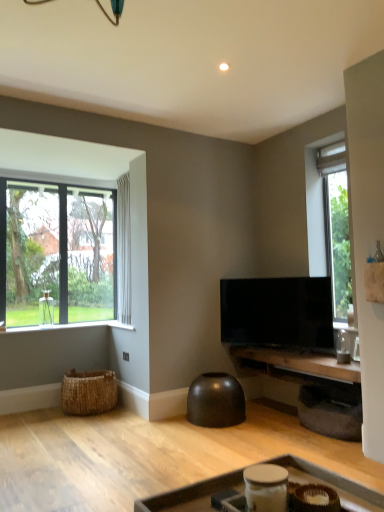
Locate an element on the screen. The image size is (384, 512). wooden table at center, the 1th table positioned from the back is located at coordinates (293, 365).

Locate an element on the screen. The width and height of the screenshot is (384, 512). wooden tray at lower center, which is the 2th table in back-to-front order is located at coordinates (191, 495).

Identify the location of clear glass window at left. (59, 253).

Measure the distance between clear glass window at left and camera.

clear glass window at left and camera are 14.50 feet apart from each other.

The height and width of the screenshot is (512, 384). What are the coordinates of `woven brown basket at lower left` in the screenshot? It's located at (88, 392).

Describe the element at coordinates (88, 392) in the screenshot. I see `woven brown basket at lower left` at that location.

The image size is (384, 512). Describe the element at coordinates (73, 326) in the screenshot. I see `white wood window sill at lower left` at that location.

Image resolution: width=384 pixels, height=512 pixels. In order to click on flat screen tv at center in this screenshot , I will do `click(277, 312)`.

Is the surface of clear glass window at left in direct contact with white wood window sill at lower left?

No, clear glass window at left is not with white wood window sill at lower left.

Is clear glass window at left oriented towards white wood window sill at lower left?

Yes, clear glass window at left is facing white wood window sill at lower left.

How many degrees apart are the facing directions of clear glass window at left and white wood window sill at lower left?

The angular difference between clear glass window at left and white wood window sill at lower left is 0.196 degrees.

Is white wood window sill at lower left surrounded by clear glass window at left?

No, white wood window sill at lower left is not surrounded by clear glass window at left.

Who is more distant, white sheer curtain at left or flat screen tv at center?

white sheer curtain at left is more distant.

Between white sheer curtain at left and flat screen tv at center, which one has smaller size?

Smaller between the two is flat screen tv at center.

Is white sheer curtain at left not near flat screen tv at center?

That's right, there is a large distance between white sheer curtain at left and flat screen tv at center.

The height and width of the screenshot is (512, 384). What are the coordinates of `curtain above the flat screen tv at center (from the image's perspective)` in the screenshot? It's located at (123, 250).

Locate an element on the screen. table that appears on the right of wooden tray at lower center, marked as the 1th table in a front-to-back arrangement is located at coordinates (293, 365).

From a real-world perspective, which object stands above the other?

In real-world perspective, wooden table at center, the 1th table positioned from the back, is above.

Who is more distant, wooden table at center, the 1th table positioned from the back, or wooden tray at lower center, which is the 2th table in back-to-front order?

wooden table at center, the 1th table positioned from the back.

Based on their sizes in the image, would you say wooden table at center, which is the 2th table from front to back, is bigger or smaller than wooden tray at lower center, which is the 2th table in back-to-front order?

In the image, wooden table at center, which is the 2th table from front to back, appears to be smaller than wooden tray at lower center, which is the 2th table in back-to-front order.

Locate an element on the screen. curtain above the wooden table at center, the 1th table positioned from the back (from the image's perspective) is located at coordinates (123, 250).

Would you say white sheer curtain at left is outside wooden table at center, the 1th table positioned from the back?

white sheer curtain at left lies outside wooden table at center, the 1th table positioned from the back,'s area.

How many degrees apart are the facing directions of white sheer curtain at left and wooden table at center, the 1th table positioned from the back?

The angular difference between white sheer curtain at left and wooden table at center, the 1th table positioned from the back, is 0.956 degrees.

Is white sheer curtain at left facing towards wooden table at center, which is the 2th table from front to back?

No, white sheer curtain at left is not turned towards wooden table at center, which is the 2th table from front to back.

Is white sheer curtain at left at the left side of woven brown basket at lower left?

In fact, white sheer curtain at left is to the right of woven brown basket at lower left.

Identify the location of basket lying in front of the white sheer curtain at left. The image size is (384, 512). (88, 392).

Is white sheer curtain at left thinner than woven brown basket at lower left?

Correct, the width of white sheer curtain at left is less than that of woven brown basket at lower left.

From the image's perspective, is white sheer curtain at left above woven brown basket at lower left?

Yes, from the image's perspective, white sheer curtain at left is on top of woven brown basket at lower left.

Which point is more distant from viewer, (254, 365) or (36, 261)?

The point (36, 261) is behind.

Could you tell me if wooden table at center, the 1th table positioned from the back, is facing clear glass window at left?

No, wooden table at center, the 1th table positioned from the back, is not oriented towards clear glass window at left.

How much distance is there between wooden table at center, which is the 2th table from front to back, and clear glass window at left?

The distance of wooden table at center, which is the 2th table from front to back, from clear glass window at left is 2.21 meters.

Which of these two, wooden table at center, which is the 2th table from front to back, or clear glass window at left, is thinner?

clear glass window at left.

From the image's perspective, is wooden table at center, which is the 2th table from front to back, above white wood window sill at lower left?

No, from the image's perspective, wooden table at center, which is the 2th table from front to back, is not above white wood window sill at lower left.

Which point is more forward, (x=255, y=374) or (x=55, y=326)?

Positioned in front is point (x=255, y=374).

Does wooden table at center, which is the 2th table from front to back, touch white wood window sill at lower left?

No, wooden table at center, which is the 2th table from front to back, is not beside white wood window sill at lower left.

In the image, there is a clear glass window at left. Where is `window sill below it (from a real-world perspective)`? The height and width of the screenshot is (512, 384). window sill below it (from a real-world perspective) is located at coordinates (73, 326).

Locate an element on the screen. television on the right of white sheer curtain at left is located at coordinates (277, 312).

Which object lies further to the anchor point woven brown basket at lower left, wooden table at center, which is the 2th table from front to back, or white sheer curtain at left?

The object further to woven brown basket at lower left is wooden table at center, which is the 2th table from front to back.

Considering their positions, is flat screen tv at center positioned closer to wooden table at center, which is the 2th table from front to back, than woven brown basket at lower left?

Among the two, flat screen tv at center is located nearer to wooden table at center, which is the 2th table from front to back.

Which object lies further to the anchor point white sheer curtain at left, wooden tray at lower center, which is the 2th table in back-to-front order, or clear glass window at left?

Based on the image, wooden tray at lower center, which is the 2th table in back-to-front order, appears to be further to white sheer curtain at left.

Looking at the image, which one is located further to clear glass window at left, wooden tray at lower center, marked as the 1th table in a front-to-back arrangement, or wooden table at center, which is the 2th table from front to back?

wooden tray at lower center, marked as the 1th table in a front-to-back arrangement, is further to clear glass window at left.

From the picture: From the image, which object appears to be farther from flat screen tv at center, wooden table at center, which is the 2th table from front to back, or white sheer curtain at left?

Based on the image, white sheer curtain at left appears to be further to flat screen tv at center.

From the image, which object appears to be farther from white sheer curtain at left, flat screen tv at center or wooden tray at lower center, marked as the 1th table in a front-to-back arrangement?

wooden tray at lower center, marked as the 1th table in a front-to-back arrangement.

Which object lies nearer to the anchor point white sheer curtain at left, clear glass window at left or flat screen tv at center?

clear glass window at left lies closer to white sheer curtain at left than the other object.

Looking at this image, looking at the image, which one is located further to wooden table at center, the 1th table positioned from the back, wooden tray at lower center, which is the 2th table in back-to-front order, or white sheer curtain at left?

wooden tray at lower center, which is the 2th table in back-to-front order, is positioned further to the anchor wooden table at center, the 1th table positioned from the back.

I want to click on curtain located between clear glass window at left and wooden table at center, the 1th table positioned from the back, in the left-right direction, so click(x=123, y=250).

In order to click on table located between wooden tray at lower center, which is the 2th table in back-to-front order, and flat screen tv at center in the depth direction in this screenshot , I will do `click(293, 365)`.

Locate an element on the screen. This screenshot has height=512, width=384. television between white wood window sill at lower left and wooden table at center, the 1th table positioned from the back, in the horizontal direction is located at coordinates (277, 312).

Identify the location of window sill between wooden tray at lower center, marked as the 1th table in a front-to-back arrangement, and clear glass window at left, along the z-axis. (73, 326).